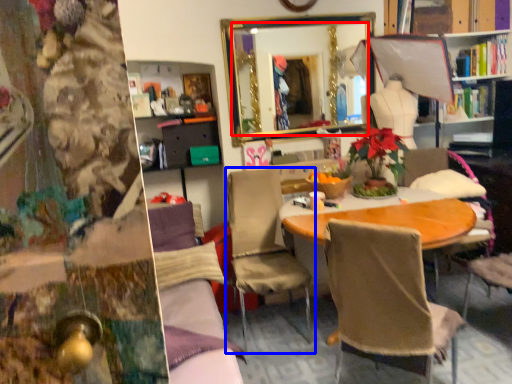
Question: Which object appears farthest to the camera in this image, mirror (highlighted by a red box) or chair (highlighted by a blue box)?

Choices:
 (A) mirror
 (B) chair

Answer: (A)